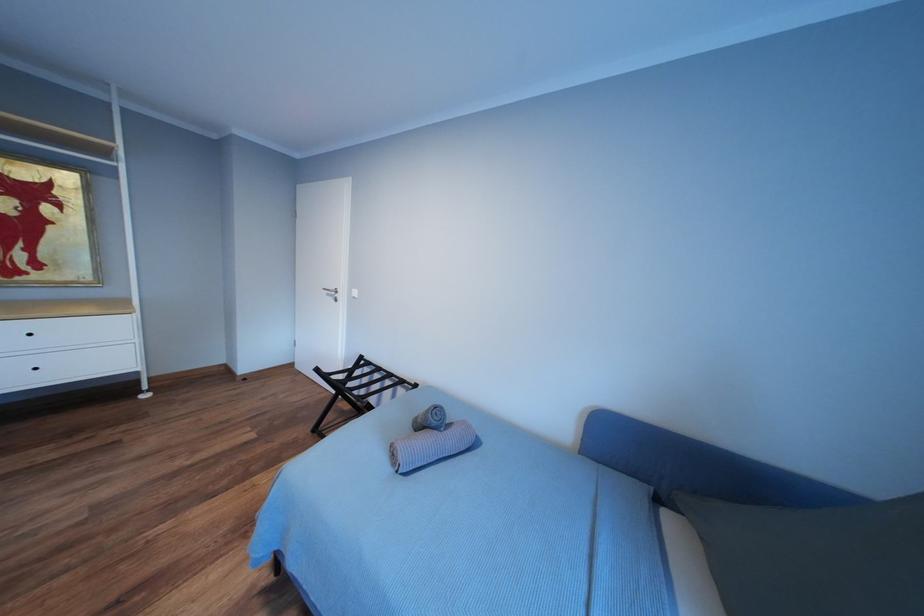
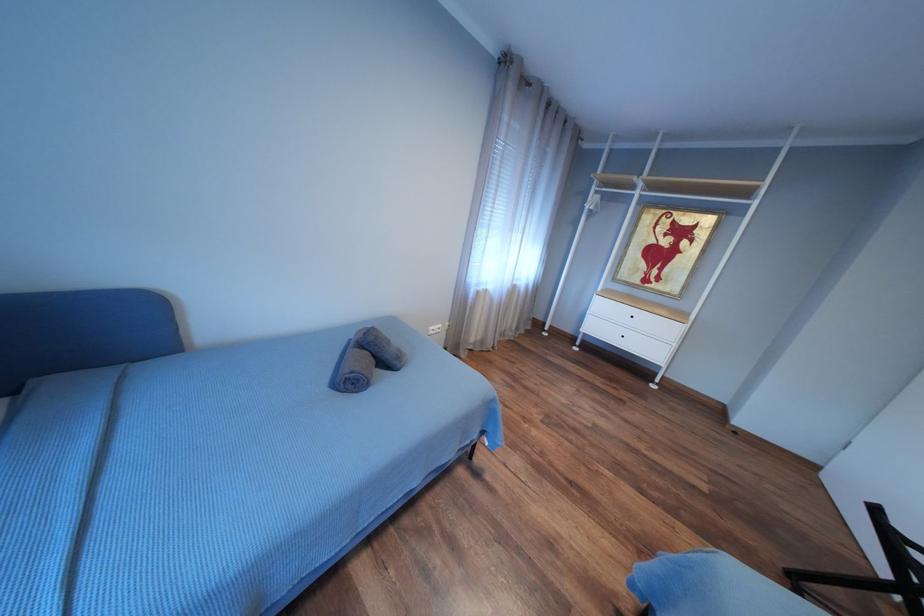
Question: The camera is either moving clockwise (left) or counter-clockwise (right) around the object. The first image is from the beginning of the video and the second image is from the end. Is the camera moving left or right when shooting the video?

Choices:
 (A) Left
 (B) Right

Answer: (B)